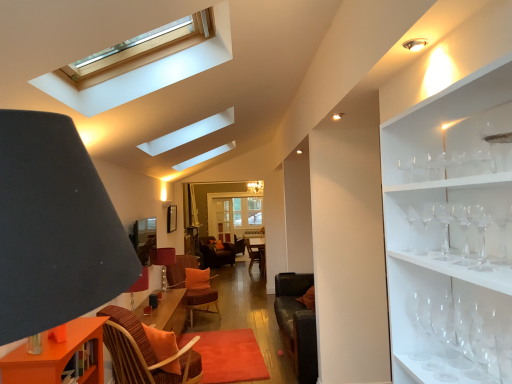
Question: Can you confirm if clear glass wine glass at right, positioned as the third wine glass in back-to-front order, is smaller than transparent glass wine glass at right, arranged as the eighth wine glass when viewed from the front?

Choices:
 (A) yes
 (B) no

Answer: (A)

Question: Is clear glass wine glass at right, positioned as the third wine glass in back-to-front order, positioned beyond the bounds of transparent glass wine glass at right, placed as the first wine glass when sorted from back to front?

Choices:
 (A) yes
 (B) no

Answer: (A)

Question: Would you say transparent glass wine glass at right, placed as the first wine glass when sorted from back to front, is part of clear glass wine glass at right, placed as the sixth wine glass when sorted from front to back,'s contents?

Choices:
 (A) yes
 (B) no

Answer: (B)

Question: From the image's perspective, does clear glass wine glass at right, placed as the sixth wine glass when sorted from front to back, appear higher than transparent glass wine glass at right, arranged as the eighth wine glass when viewed from the front?

Choices:
 (A) yes
 (B) no

Answer: (A)

Question: From a real-world perspective, is clear glass wine glass at right, positioned as the third wine glass in back-to-front order, on top of transparent glass wine glass at right, placed as the first wine glass when sorted from back to front?

Choices:
 (A) no
 (B) yes

Answer: (B)

Question: Looking at the image, does matte brown table lamp at center seem bigger or smaller compared to orange fabric pillow at center?

Choices:
 (A) small
 (B) big

Answer: (B)

Question: From a real-world perspective, is matte brown table lamp at center above or below orange fabric pillow at center?

Choices:
 (A) above
 (B) below

Answer: (A)

Question: Visually, is matte brown table lamp at center positioned to the left or to the right of orange fabric pillow at center?

Choices:
 (A) right
 (B) left

Answer: (B)

Question: From the image's perspective, is matte brown table lamp at center above or below orange fabric pillow at center?

Choices:
 (A) above
 (B) below

Answer: (A)

Question: From the image's perspective, is clear glass wine glass at right, placed as the sixth wine glass when sorted from front to back, located above or below orange fabric pillow at center?

Choices:
 (A) below
 (B) above

Answer: (B)

Question: Considering the positions of clear glass wine glass at right, placed as the sixth wine glass when sorted from front to back, and orange fabric pillow at center in the image, is clear glass wine glass at right, placed as the sixth wine glass when sorted from front to back, bigger or smaller than orange fabric pillow at center?

Choices:
 (A) big
 (B) small

Answer: (B)

Question: Would you say clear glass wine glass at right, placed as the sixth wine glass when sorted from front to back, is to the left or to the right of orange fabric pillow at center in the picture?

Choices:
 (A) left
 (B) right

Answer: (B)

Question: Is clear glass wine glass at right, positioned as the third wine glass in back-to-front order, wider or thinner than orange fabric pillow at center?

Choices:
 (A) thin
 (B) wide

Answer: (A)

Question: Is orange fabric pillow at center bigger or smaller than transparent glass wine glass at right, which is the seventh wine glass in front-to-back order?

Choices:
 (A) big
 (B) small

Answer: (A)

Question: Is orange fabric pillow at center inside or outside of transparent glass wine glass at right, which ranks as the 2th wine glass in back-to-front order?

Choices:
 (A) outside
 (B) inside

Answer: (A)